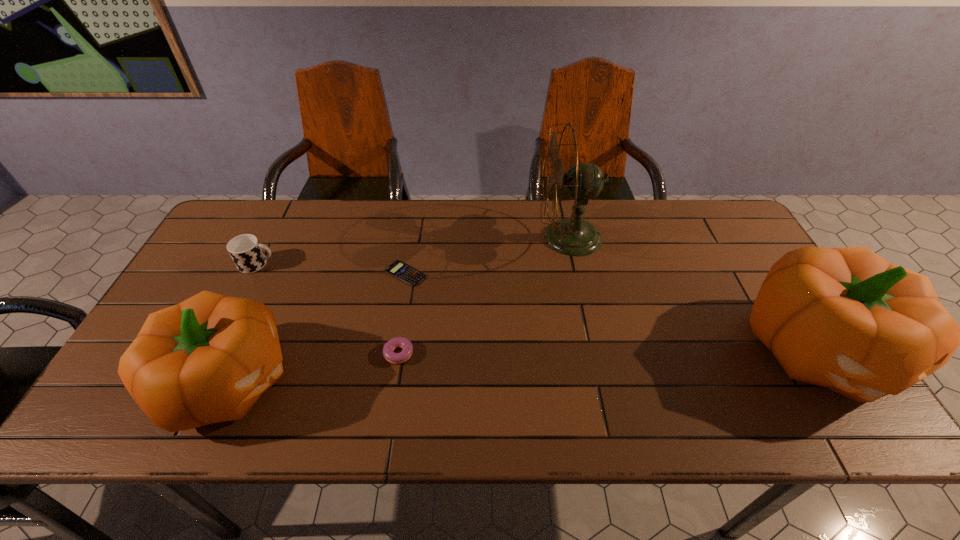
The height and width of the screenshot is (540, 960). Find the location of `free region located 0.070m in front of the second object from right to left, directing air flow`. free region located 0.070m in front of the second object from right to left, directing air flow is located at coordinates (516, 237).

The width and height of the screenshot is (960, 540). What are the coordinates of `vacant space positioned 0.170m in front of the second object from right to left, directing air flow` in the screenshot? It's located at (484, 237).

Find the location of a particular element. The width and height of the screenshot is (960, 540). free location located in front of the second object from right to left, directing air flow is located at coordinates (478, 237).

Where is `vacant space situated on the front of the shortest object`? vacant space situated on the front of the shortest object is located at coordinates (386, 389).

The width and height of the screenshot is (960, 540). Find the location of `vacant region located 0.080m on the side of the third shortest object with the handle`. vacant region located 0.080m on the side of the third shortest object with the handle is located at coordinates (303, 264).

Where is `vacant area situated on the left of the fifth tallest object`? Image resolution: width=960 pixels, height=540 pixels. vacant area situated on the left of the fifth tallest object is located at coordinates (233, 354).

This screenshot has width=960, height=540. I want to click on object situated at the far edge, so click(573, 236).

This screenshot has height=540, width=960. I want to click on doughnut located in the near edge section of the desktop, so click(407, 348).

This screenshot has width=960, height=540. I want to click on pumpkin present at the left edge, so click(x=208, y=359).

This screenshot has height=540, width=960. Identify the location of cup present at the left edge. (246, 251).